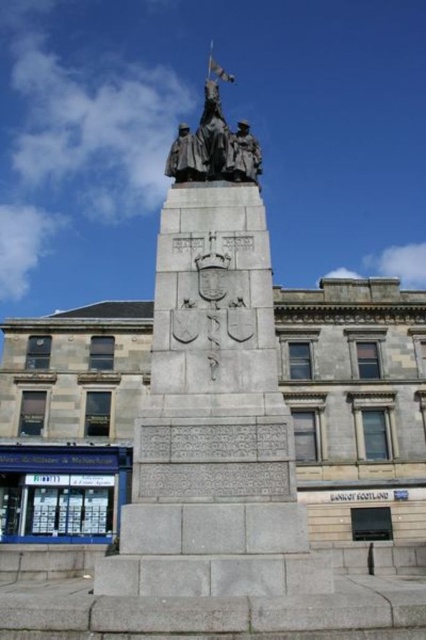
Can you confirm if bronze statue at center is positioned below polished bronze statue at center?

Indeed, bronze statue at center is positioned under polished bronze statue at center.

Between bronze statue at center and polished bronze statue at center, which one has more height?

Standing taller between the two is polished bronze statue at center.

Between point (126, 557) and point (244, 125), which one is positioned behind?

The point (244, 125) is more distant.

This screenshot has width=426, height=640. What are the coordinates of `bronze statue at center` in the screenshot? It's located at (213, 394).